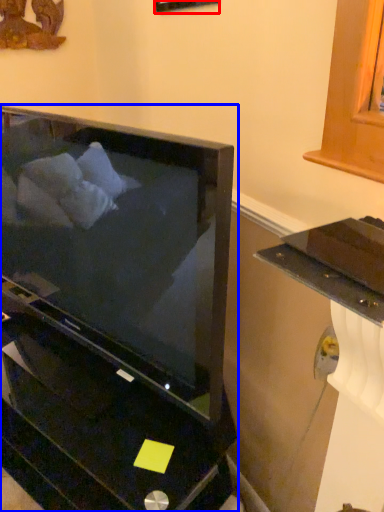
Question: Which object is closer to the camera taking this photo, picture frame (highlighted by a red box) or furniture (highlighted by a blue box)?

Choices:
 (A) picture frame
 (B) furniture

Answer: (B)